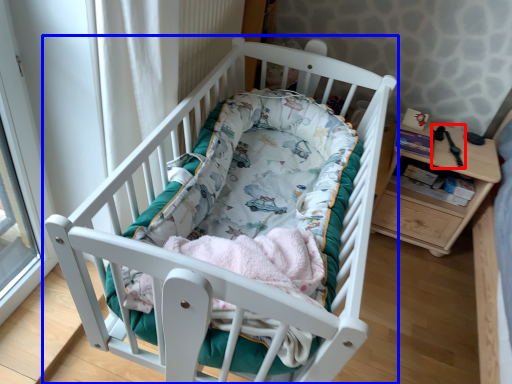
Question: Which of the following is the closest to the observer, equipment (highlighted by a red box) or infant bed (highlighted by a blue box)?

Choices:
 (A) equipment
 (B) infant bed

Answer: (B)